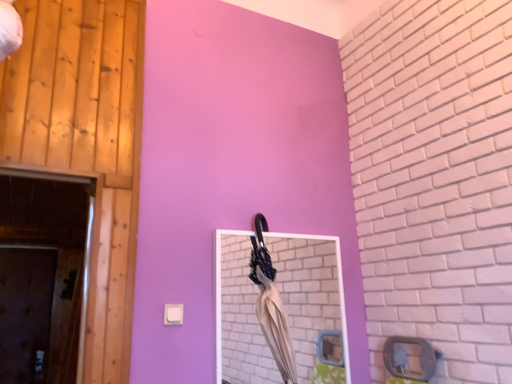
Question: In the image, is matte white mirror at center on the left side or the right side of beige fabric umbrella at center?

Choices:
 (A) left
 (B) right

Answer: (B)

Question: Based on their sizes in the image, would you say matte white mirror at center is bigger or smaller than beige fabric umbrella at center?

Choices:
 (A) big
 (B) small

Answer: (A)

Question: Which object is the closest to the matte white mirror at center?

Choices:
 (A) brown matte door at lower left, which is the second door in right-to-left order
 (B) beige fabric umbrella at center
 (C) wooden at left, which is counted as the first door, starting from the right

Answer: (B)

Question: Which object is positioned farthest from the wooden at left, which is counted as the first door, starting from the right?

Choices:
 (A) brown matte door at lower left, the first door when ordered from bottom to top
 (B) beige fabric umbrella at center
 (C) matte white mirror at center

Answer: (A)